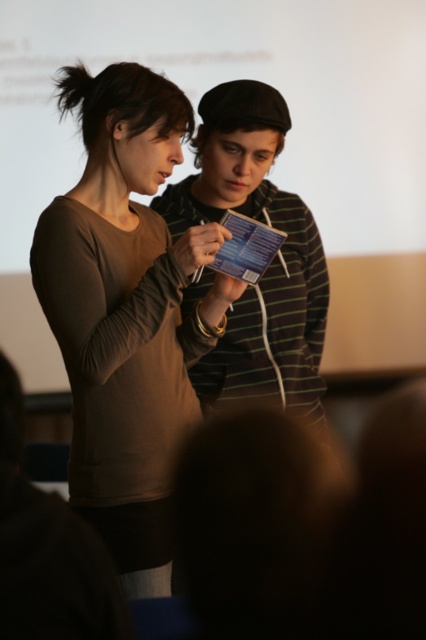
You are organizing a photo shoot and need to arrange two models wearing the matte brown shirt at center and the striped cotton sweater at center. Based on the scene description, which model should stand in front to ensure both are visible in the photo?

The striped cotton sweater at center should stand in front because the matte brown shirt at center is taller, so placing the shorter striped cotton sweater at center in front would allow both to be visible without one blocking the other.

You are an attendee at this presentation and want to approach the person wearing the striped cotton sweater at center to ask a question. Which direction should you move relative to the matte brown shirt at center?

You should move towards the striped cotton sweater at center, which is behind the matte brown shirt at center. Since the matte brown shirt at center is closer to you, you would need to go around or behind it to reach the striped cotton sweater at center.